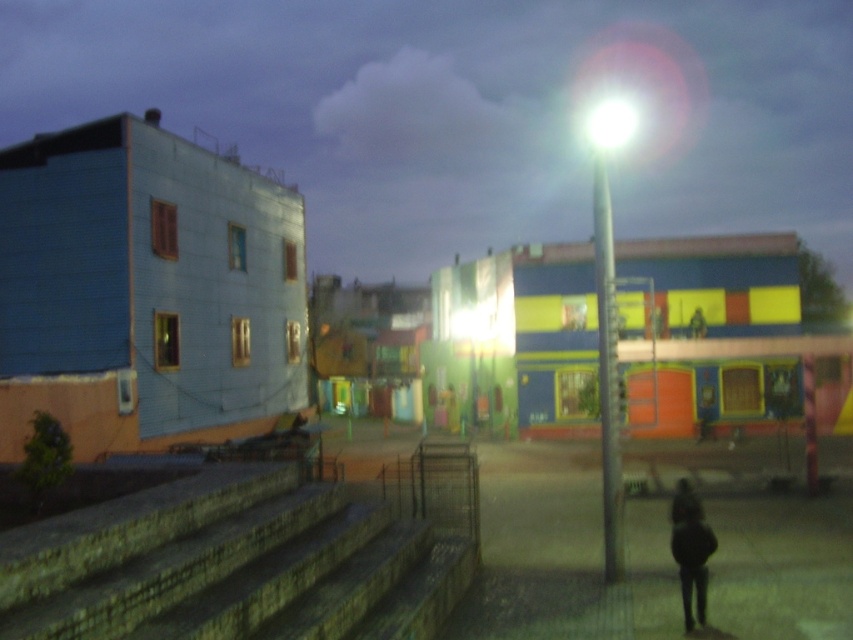
You are standing at the entrance of the light blue building with orange accents and want to go up the steps. There are two sets of steps in front of you, the matte concrete steps at lower left and the stone steps at lower left. Which set of steps is closer to you?

The matte concrete steps at lower left are closer to you since they are further to the viewer than the stone steps at lower left.

In the scene shown: You are a delivery person trying to park your 1.2 meter wide cart between the stone steps at lower left and the silver metallic pole at center. Can you fit your cart there?

The stone steps at lower left is thinner than silver metallic pole at center. However, the width of the space between them isn not provided, so we cannot determine if the cart will fit.